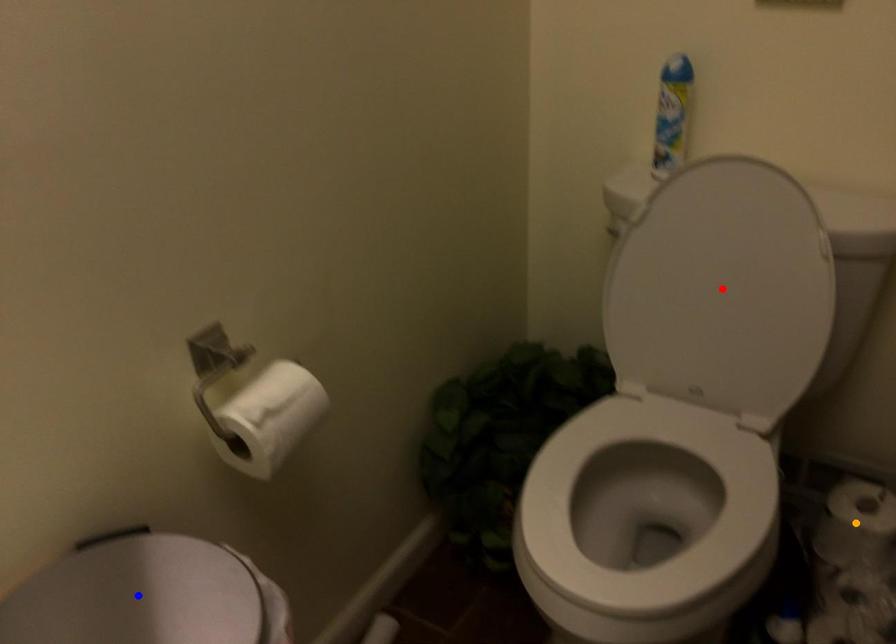
Order these from farthest to nearest:
orange point
red point
blue point

orange point, red point, blue point